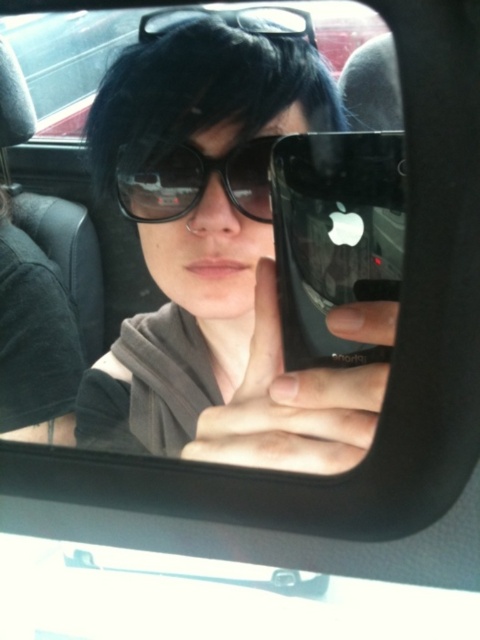
Which is behind, point (374, 296) or point (256, 8)?

The point (256, 8) is behind.

Can you confirm if black glossy phone at center is thinner than black matte sunglasses at upper center?

Indeed, black glossy phone at center has a lesser width compared to black matte sunglasses at upper center.

Find the location of a particular element. This screenshot has width=480, height=640. black glossy phone at center is located at coordinates (335, 236).

Is matte black sunglasses at center below black plastic sunglasses at center?

Yes, matte black sunglasses at center is below black plastic sunglasses at center.

Does matte black sunglasses at center have a greater height compared to black plastic sunglasses at center?

Correct, matte black sunglasses at center is much taller as black plastic sunglasses at center.

The height and width of the screenshot is (640, 480). Find the location of `matte black sunglasses at center`. matte black sunglasses at center is located at coordinates (214, 257).

Which is more to the left, black glossy phone at center or black plastic sunglasses at center?

From the viewer's perspective, black plastic sunglasses at center appears more on the left side.

Does black glossy phone at center have a smaller size compared to black plastic sunglasses at center?

Yes.

Identify the location of black glossy phone at center. This screenshot has height=640, width=480. (335, 236).